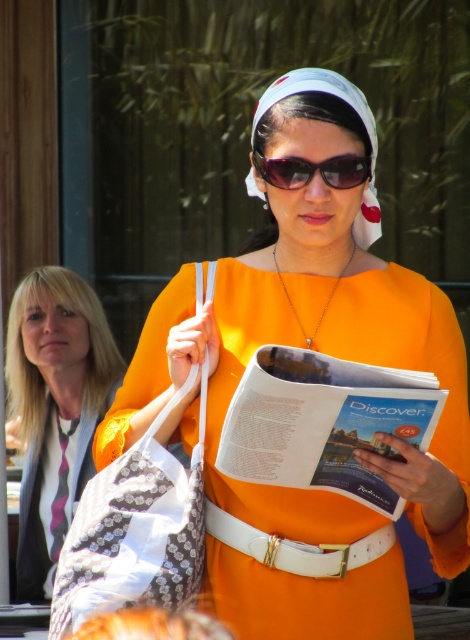
Question: Can you confirm if patterned fabric bag at center is positioned below white leather belt at center?

Choices:
 (A) no
 (B) yes

Answer: (A)

Question: Is orange matte dress at center thinner than matte paper magazine at center?

Choices:
 (A) yes
 (B) no

Answer: (B)

Question: Is orange matte dress at center positioned before patterned fabric bag at center?

Choices:
 (A) yes
 (B) no

Answer: (A)

Question: Based on their relative distances, which object is nearer to the patterned fabric bag at center?

Choices:
 (A) matte paper magazine at center
 (B) white leather belt at center
 (C) blonde hair at left
 (D) sunglasses at center

Answer: (B)

Question: Based on their relative distances, which object is farther from the blonde hair at left?

Choices:
 (A) sunglasses at center
 (B) orange matte dress at center
 (C) white leather belt at center
 (D) patterned fabric bag at center

Answer: (A)

Question: Which of the following is the closest to the observer?

Choices:
 (A) matte paper magazine at center
 (B) orange matte dress at center

Answer: (A)